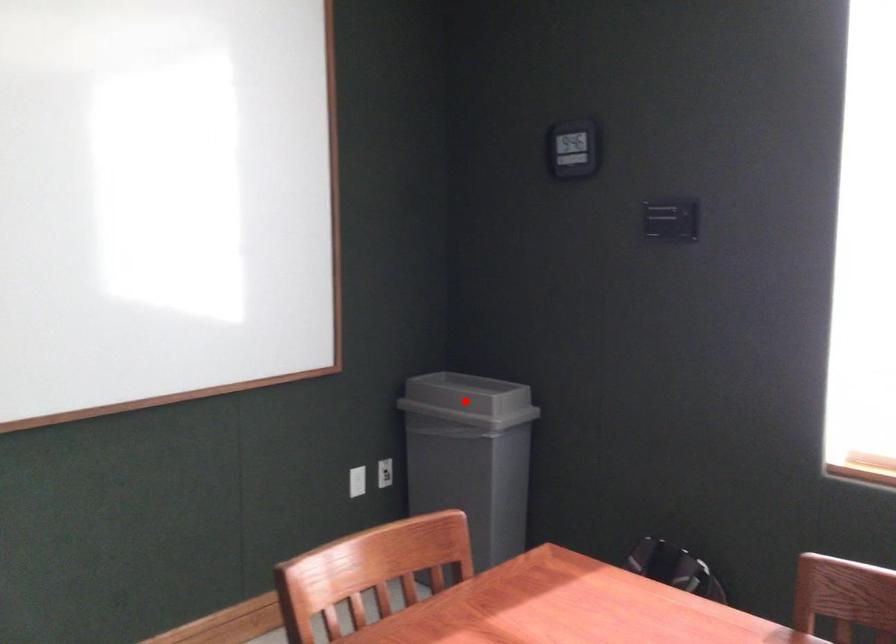
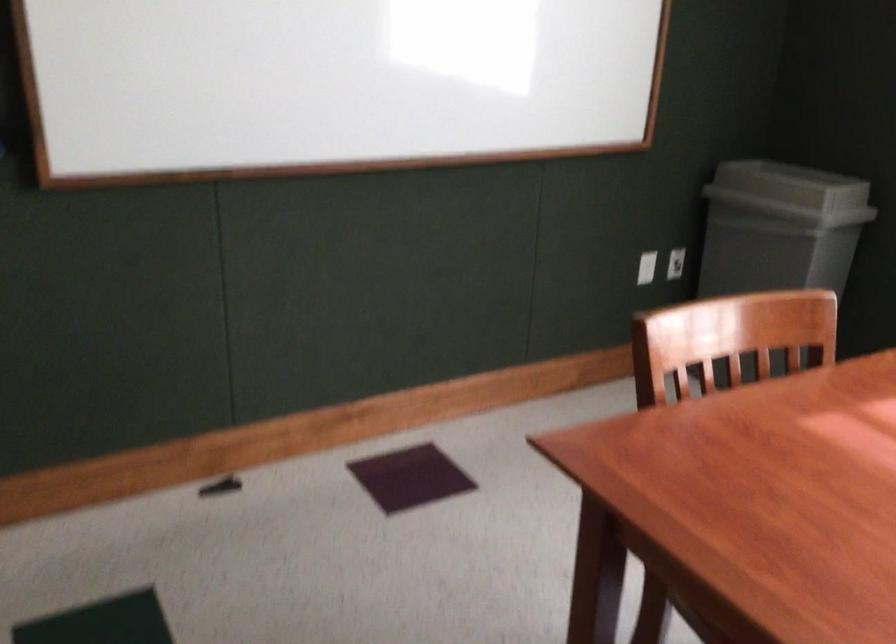
Question: I am providing you with two images of the same scene from different viewpoints. Image1 has a red point marked. In image2, the corresponding 3D location appears at what relative position? Reply with the corresponding letter.

Choices:
 (A) Closer
 (B) Farther

Answer: (A)